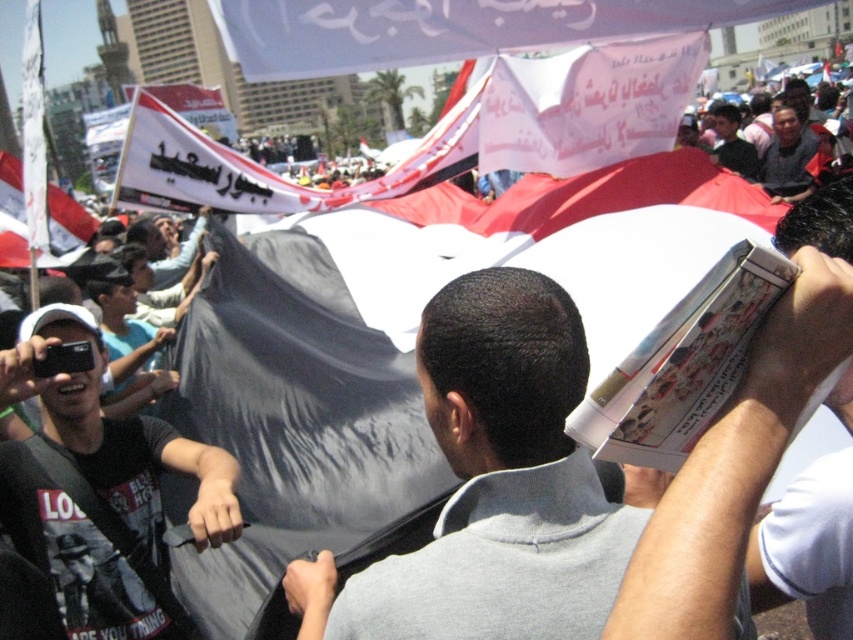
Question: Which object appears closest to the camera in this image?

Choices:
 (A) dark gray fabric at upper right
 (B) black matte t-shirt at left

Answer: (B)

Question: Which object is closer to the camera taking this photo?

Choices:
 (A) white paper banner at center
 (B) white paper book at center
 (C) dark gray fabric at upper center

Answer: (B)

Question: Does gray matte book at center have a smaller size compared to dark gray fabric at upper right?

Choices:
 (A) yes
 (B) no

Answer: (A)

Question: Where is gray matte book at center located in relation to dark gray fabric at upper center in the image?

Choices:
 (A) above
 (B) below

Answer: (B)

Question: Which object is farther from the camera taking this photo?

Choices:
 (A) black matte t-shirt at left
 (B) white paper banner at center
 (C) dark gray fabric at upper right

Answer: (C)

Question: Does black matte t-shirt at left lie behind white paper banner at center?

Choices:
 (A) yes
 (B) no

Answer: (B)